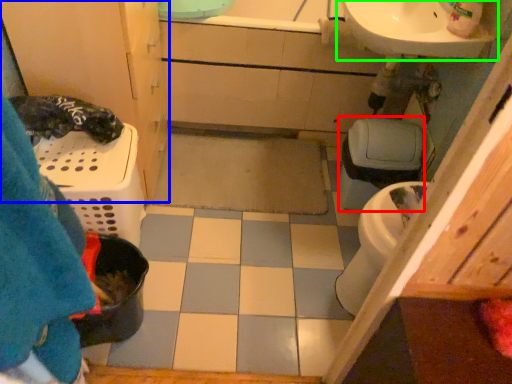
Question: Estimate the real-world distances between objects in this image. Which object is closer to toilet bowl (highlighted by a red box), bathroom cabinet (highlighted by a blue box) or sink (highlighted by a green box)?

Choices:
 (A) bathroom cabinet
 (B) sink

Answer: (B)